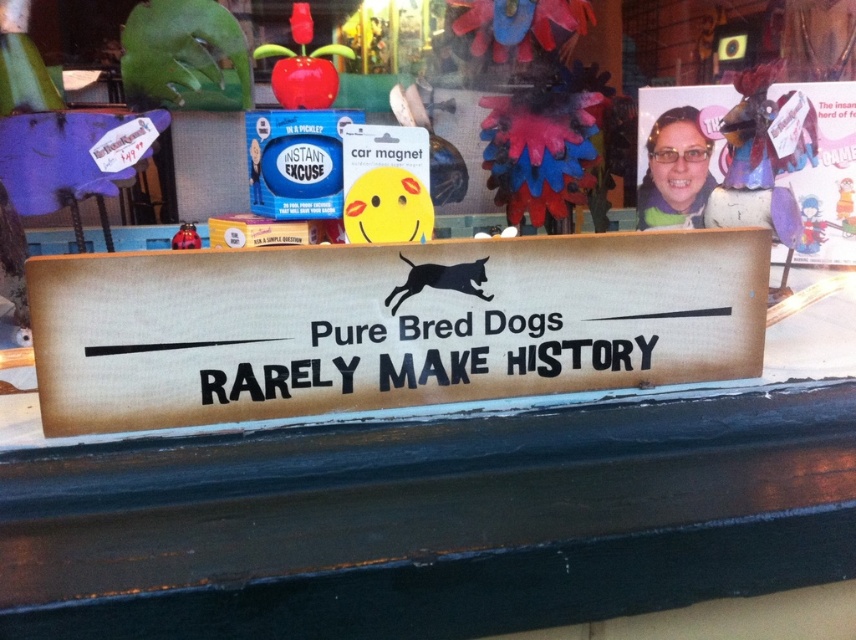
Is matte plastic photo at upper right taller than black wood sign at center?

Correct, matte plastic photo at upper right is much taller as black wood sign at center.

Can you confirm if matte plastic photo at upper right is bigger than black wood sign at center?

Yes.

Is point (712, 196) closer to viewer compared to point (328, 371)?

No, it is behind (328, 371).

The image size is (856, 640). In order to click on matte plastic photo at upper right in this screenshot , I will do `click(753, 163)`.

Where is `wooden signboard at center`? wooden signboard at center is located at coordinates (387, 324).

Does wooden signboard at center lie behind black wood sign at center?

No, wooden signboard at center is in front of black wood sign at center.

Is point (289, 404) positioned in front of point (282, 380)?

No.

Find the location of a particular element. wooden signboard at center is located at coordinates (387, 324).

Who is shorter, wooden signboard at center or matte plastic photo at upper right?

Standing shorter between the two is wooden signboard at center.

Which is behind, point (545, 298) or point (749, 136)?

Positioned behind is point (749, 136).

Describe the element at coordinates (387, 324) in the screenshot. The width and height of the screenshot is (856, 640). I see `wooden signboard at center` at that location.

Where is `wooden signboard at center`? This screenshot has width=856, height=640. wooden signboard at center is located at coordinates (387, 324).